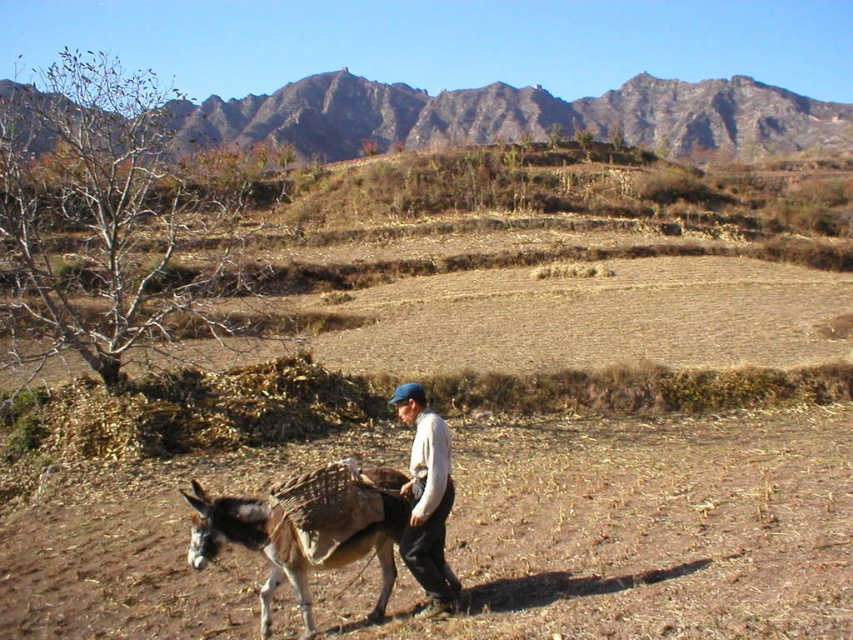
Consider the image. You are a hiker who wants to reach the top of the brown grassy hillside at upper center. You are currently standing next to the brown textured donkey at lower left. In which direction should you head to climb the hill?

The brown grassy hillside at upper center is to the right of the brown textured donkey at lower left, so you should head to the right to climb the hill.